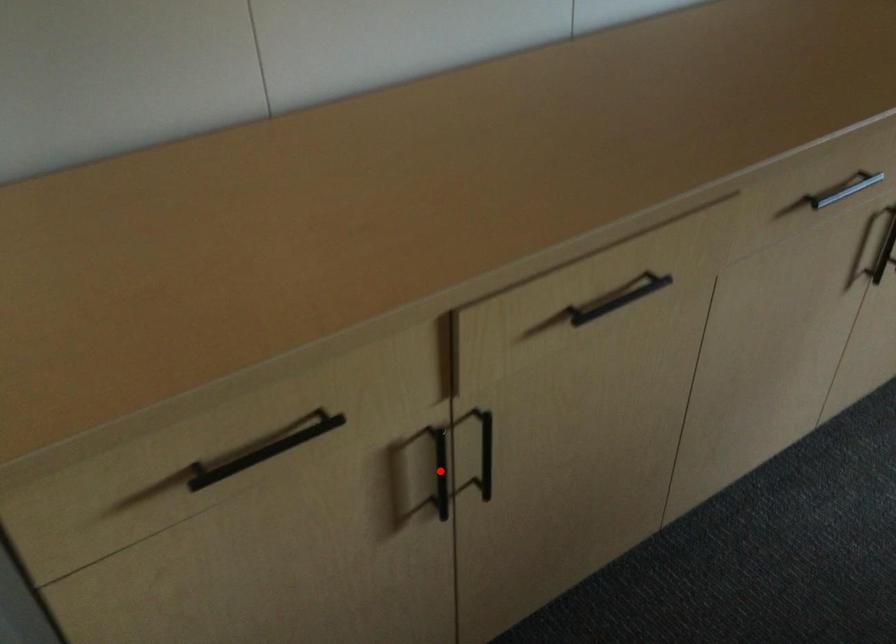
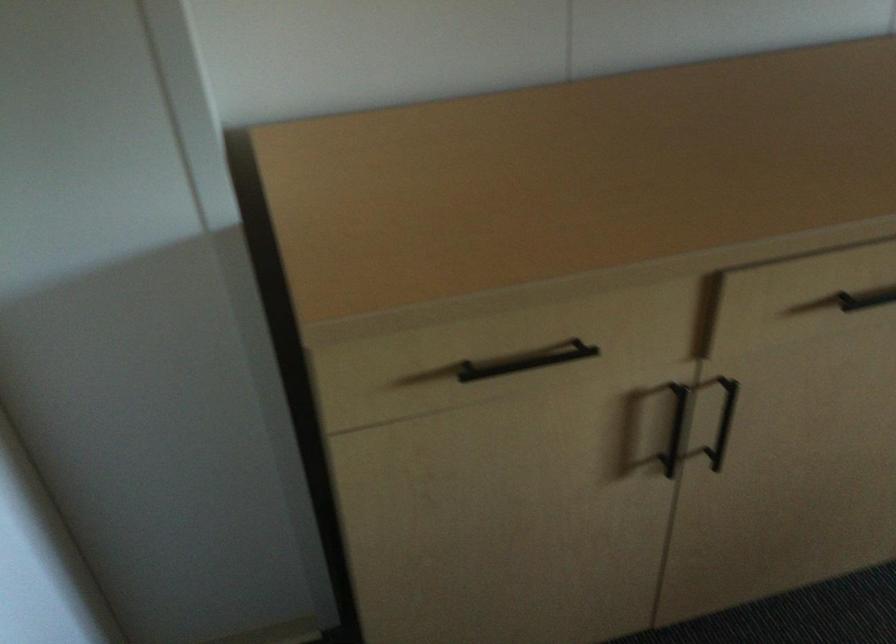
Locate, in the second image, the point that corresponds to the highlighted location in the first image.

(675, 428)